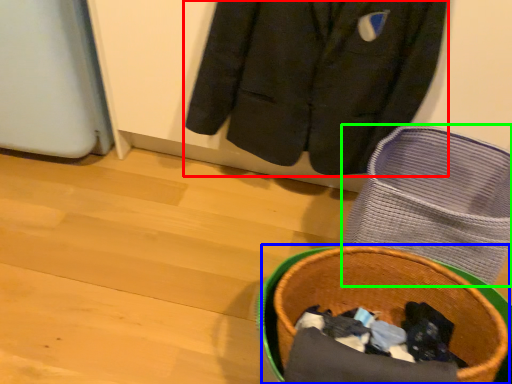
Question: Estimate the real-world distances between objects in this image. Which object is farther from jacket (highlighted by a red box), basket container (highlighted by a blue box) or footwear (highlighted by a green box)?

Choices:
 (A) basket container
 (B) footwear

Answer: (A)